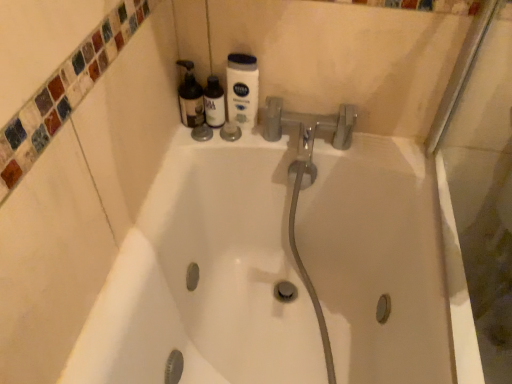
Question: Is translucent plastic bottles at upper left, marked as the 2th cleaning product in a right-to-left arrangement, positioned before white matte nivea lotion at upper center, marked as the second cleaning product in a left-to-right arrangement?

Choices:
 (A) yes
 (B) no

Answer: (B)

Question: Is translucent plastic bottles at upper left, marked as the 2th cleaning product in a right-to-left arrangement, further to camera compared to white matte nivea lotion at upper center, marked as the second cleaning product in a left-to-right arrangement?

Choices:
 (A) no
 (B) yes

Answer: (B)

Question: Is translucent plastic bottles at upper left, marked as the 2th cleaning product in a right-to-left arrangement, not near white matte nivea lotion at upper center, marked as the 1th cleaning product in a right-to-left arrangement?

Choices:
 (A) yes
 (B) no

Answer: (B)

Question: From a real-world perspective, is translucent plastic bottles at upper left, marked as the 2th cleaning product in a right-to-left arrangement, under white matte nivea lotion at upper center, marked as the second cleaning product in a left-to-right arrangement?

Choices:
 (A) yes
 (B) no

Answer: (A)

Question: From the image's perspective, would you say translucent plastic bottles at upper left, marked as the 2th cleaning product in a right-to-left arrangement, is positioned over white matte nivea lotion at upper center, marked as the 1th cleaning product in a right-to-left arrangement?

Choices:
 (A) yes
 (B) no

Answer: (A)

Question: Does translucent plastic bottles at upper left, marked as the 2th cleaning product in a right-to-left arrangement, have a larger size compared to white matte nivea lotion at upper center, marked as the 1th cleaning product in a right-to-left arrangement?

Choices:
 (A) yes
 (B) no

Answer: (A)

Question: Does white matte nivea lotion at upper center, marked as the 1th cleaning product in a right-to-left arrangement, come behind translucent plastic bottle at upper center?

Choices:
 (A) no
 (B) yes

Answer: (A)

Question: Does white matte nivea lotion at upper center, marked as the second cleaning product in a left-to-right arrangement, have a greater height compared to translucent plastic bottle at upper center?

Choices:
 (A) no
 (B) yes

Answer: (B)

Question: From a real-world perspective, is white matte nivea lotion at upper center, marked as the 1th cleaning product in a right-to-left arrangement, located beneath translucent plastic bottle at upper center?

Choices:
 (A) yes
 (B) no

Answer: (B)

Question: Is white matte nivea lotion at upper center, marked as the 1th cleaning product in a right-to-left arrangement, completely or partially outside of translucent plastic bottle at upper center?

Choices:
 (A) no
 (B) yes

Answer: (B)

Question: Is white matte nivea lotion at upper center, marked as the second cleaning product in a left-to-right arrangement, with translucent plastic bottle at upper center?

Choices:
 (A) no
 (B) yes

Answer: (B)

Question: Is white matte nivea lotion at upper center, marked as the 1th cleaning product in a right-to-left arrangement, closer to camera compared to translucent plastic bottle at upper center?

Choices:
 (A) no
 (B) yes

Answer: (B)

Question: Can you see translucent plastic bottle at upper center touching white matte nivea lotion at upper center, marked as the 1th cleaning product in a right-to-left arrangement?

Choices:
 (A) yes
 (B) no

Answer: (A)